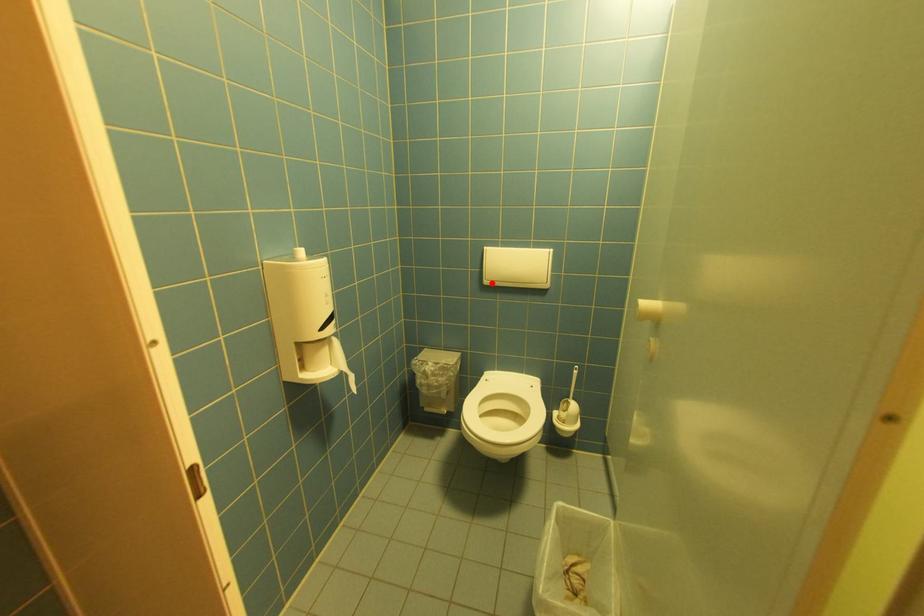
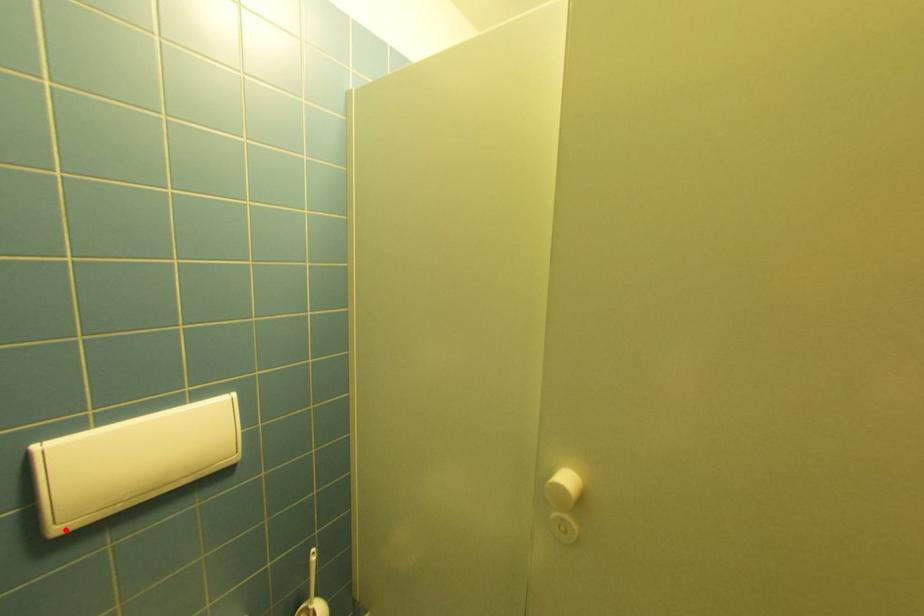
I am providing you with two images of the same scene from different viewpoints. A red point is marked on the first image and another point is marked on the second image. Does the point marked in image1 correspond to the same location as the one in image2?

Yes